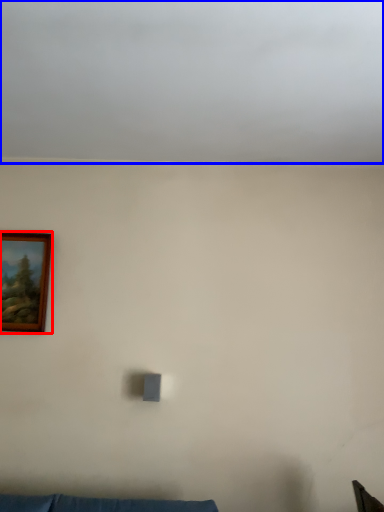
Question: Which point is further to the camera, picture frame (highlighted by a red box) or cloud (highlighted by a blue box)?

Choices:
 (A) picture frame
 (B) cloud

Answer: (A)